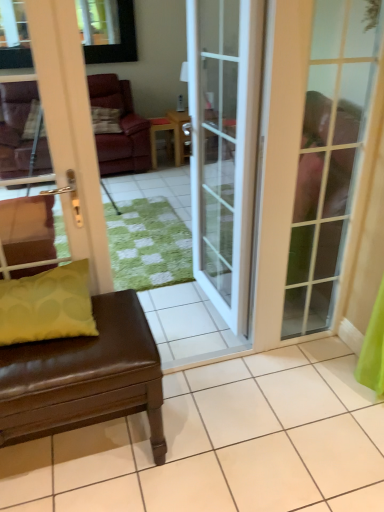
Question: From a real-world perspective, is matte yellow pillow at lower left positioned over white glossy door at left, which is the 1th door from left to right, based on gravity?

Choices:
 (A) no
 (B) yes

Answer: (A)

Question: Does matte yellow pillow at lower left have a smaller size compared to white glossy door at left, which is the 1th door from left to right?

Choices:
 (A) no
 (B) yes

Answer: (B)

Question: Does matte yellow pillow at lower left have a lesser width compared to white glossy door at left, which is the 1th door from left to right?

Choices:
 (A) no
 (B) yes

Answer: (A)

Question: Does matte yellow pillow at lower left have a larger size compared to white glossy door at left, the third door viewed from the right?

Choices:
 (A) yes
 (B) no

Answer: (B)

Question: Is matte yellow pillow at lower left far from white glossy door at left, the third door viewed from the right?

Choices:
 (A) no
 (B) yes

Answer: (A)

Question: Would you say white glass door at center, the second door viewed from the left, is to the left or to the right of matte glass door at right, which appears as the third door when viewed from the left, in the picture?

Choices:
 (A) right
 (B) left

Answer: (B)

Question: Considering the positions of white glass door at center, the second door viewed from the left, and matte glass door at right, positioned as the first door in right-to-left order, in the image, is white glass door at center, the second door viewed from the left, taller or shorter than matte glass door at right, positioned as the first door in right-to-left order,?

Choices:
 (A) short
 (B) tall

Answer: (B)

Question: Is white glass door at center, the 2th door when ordered from right to left, in front of or behind matte glass door at right, which appears as the third door when viewed from the left, in the image?

Choices:
 (A) behind
 (B) front

Answer: (A)

Question: Is white glass door at center, the 2th door when ordered from right to left, inside the boundaries of matte glass door at right, positioned as the first door in right-to-left order, or outside?

Choices:
 (A) inside
 (B) outside

Answer: (B)

Question: In terms of height, does matte glass door at right, positioned as the first door in right-to-left order, look taller or shorter compared to brown leather studio couch at left?

Choices:
 (A) tall
 (B) short

Answer: (A)

Question: Is point (312, 64) positioned closer to the camera than point (39, 426)?

Choices:
 (A) closer
 (B) farther

Answer: (B)

Question: In terms of size, does matte glass door at right, positioned as the first door in right-to-left order, appear bigger or smaller than brown leather studio couch at left?

Choices:
 (A) small
 (B) big

Answer: (A)

Question: Considering their positions, is matte glass door at right, positioned as the first door in right-to-left order, located in front of or behind brown leather studio couch at left?

Choices:
 (A) behind
 (B) front

Answer: (A)

Question: Is wooden side table at center inside the boundaries of white glossy door at left, the third door viewed from the right, or outside?

Choices:
 (A) outside
 (B) inside

Answer: (A)

Question: From the image's perspective, is wooden side table at center above or below white glossy door at left, which is the 1th door from left to right?

Choices:
 (A) above
 (B) below

Answer: (A)